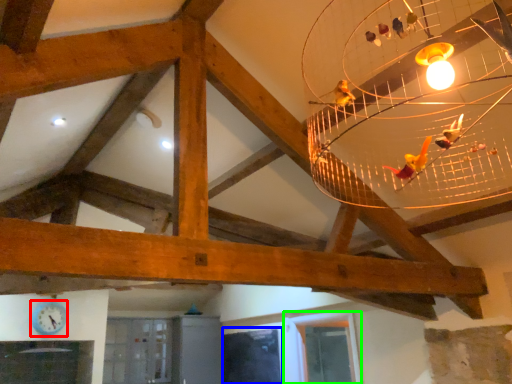
Question: Based on their relative distances, which object is farther from clock (highlighted by a red box)? Choose from window (highlighted by a blue box) and window (highlighted by a green box).

Choices:
 (A) window
 (B) window

Answer: (B)